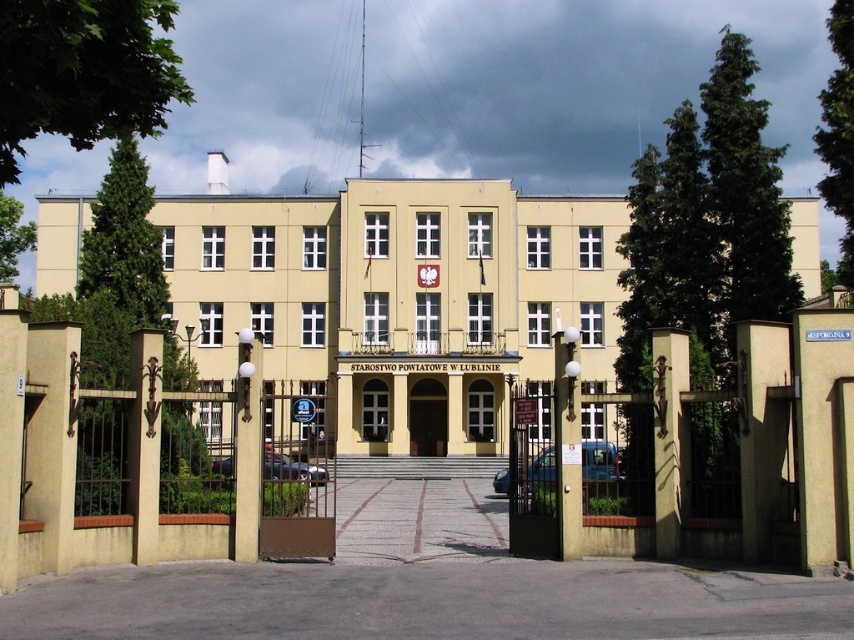
Which is above, beige concrete building at center or brown wooden door at center?

beige concrete building at center is higher up.

Is beige concrete building at center closer to camera compared to brown wooden door at center?

Yes, beige concrete building at center is in front of brown wooden door at center.

Consider the image. Who is more forward, (469, 420) or (411, 397)?

Point (411, 397)

The width and height of the screenshot is (854, 640). In order to click on beige concrete building at center in this screenshot , I will do `click(398, 291)`.